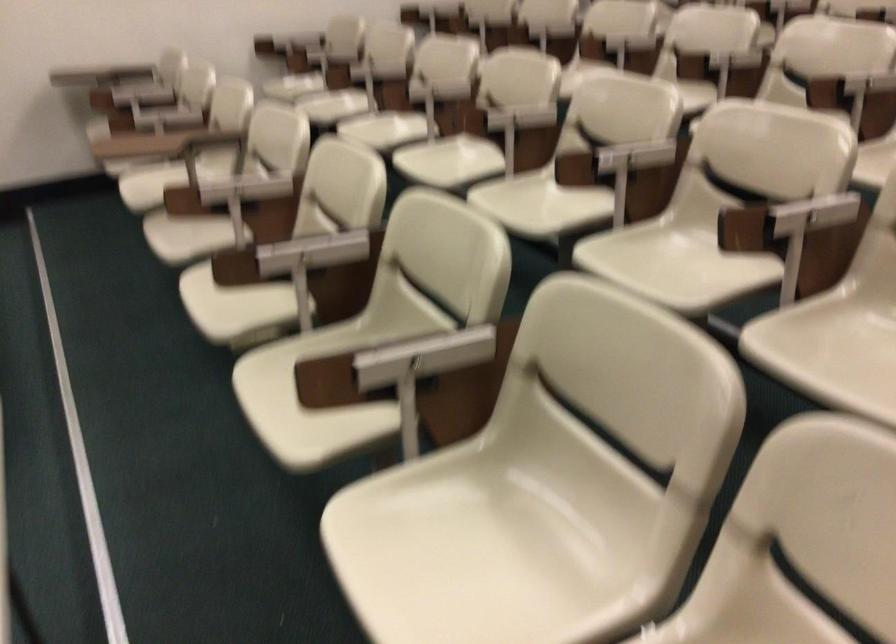
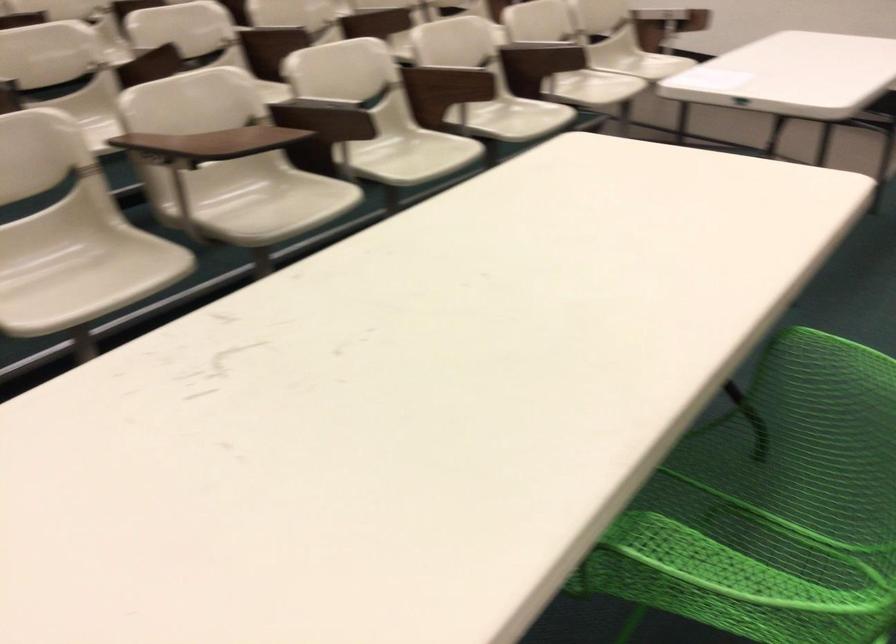
In the second image, find the point that corresponds to point 211,145 in the first image.

(174, 147)